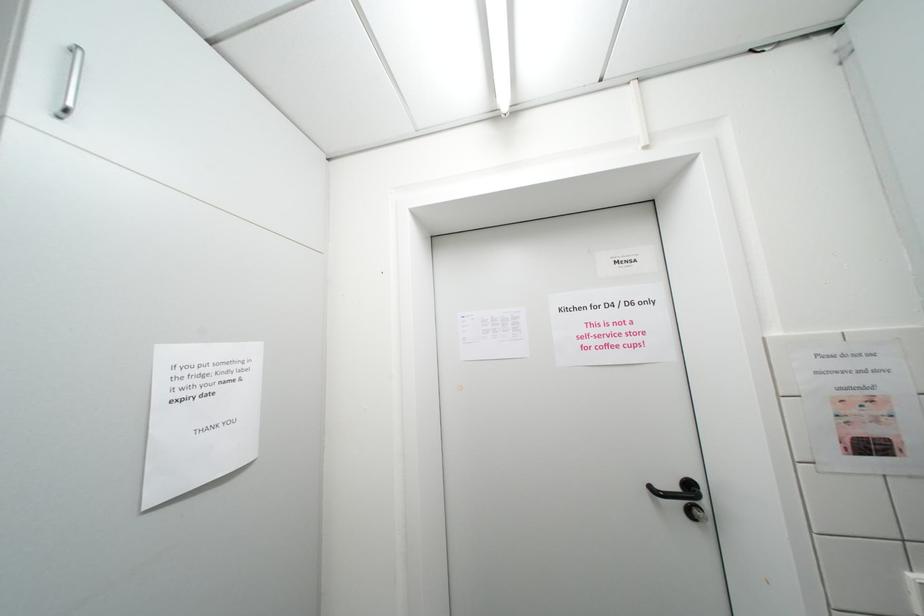
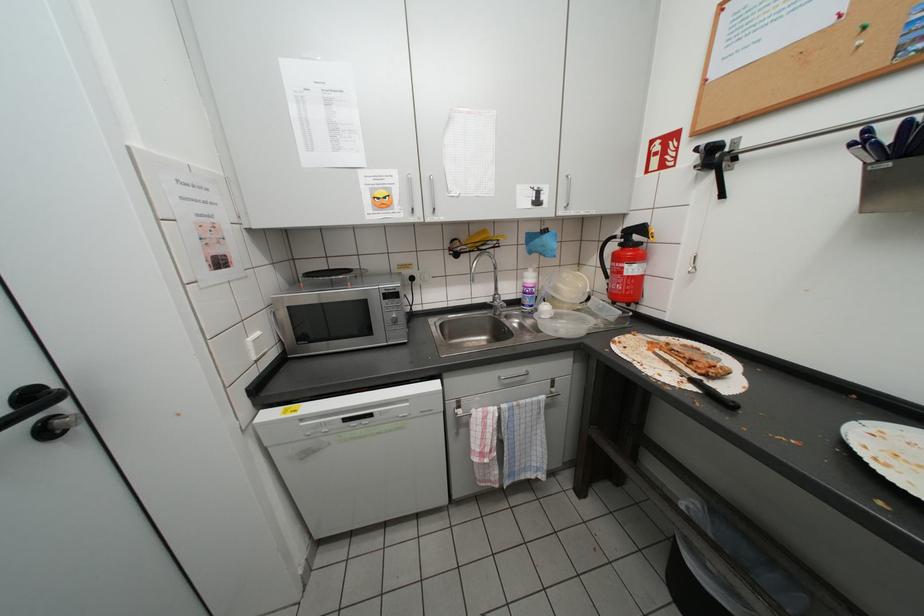
Question: The first image is from the beginning of the video and the second image is from the end. How did the camera likely rotate when shooting the video?

Choices:
 (A) Left
 (B) Right
 (C) Up
 (D) Down

Answer: (B)